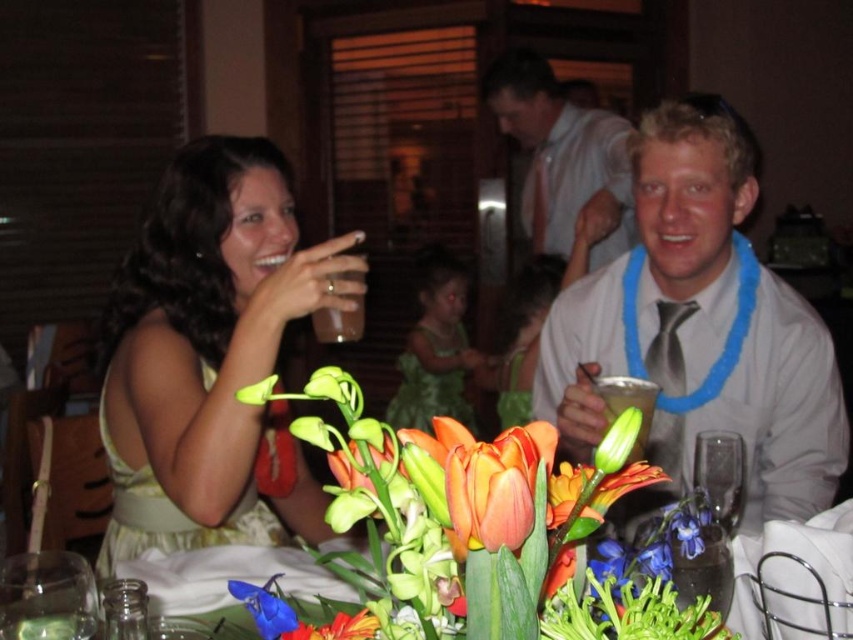
Question: Does white satin shirt at upper center appear over translucent plastic cup at upper center?

Choices:
 (A) yes
 (B) no

Answer: (A)

Question: Among these points, which one is farthest from the camera?

Choices:
 (A) pyautogui.click(x=688, y=611)
 (B) pyautogui.click(x=669, y=193)
 (C) pyautogui.click(x=93, y=621)

Answer: (B)

Question: Among these objects, which one is farthest from the camera?

Choices:
 (A) matte yellow dress at left
 (B) clear glass at lower left

Answer: (A)

Question: Can you confirm if silver metallic shirt at center is positioned above vibrant orange tulips at center?

Choices:
 (A) yes
 (B) no

Answer: (A)

Question: Among these points, which one is nearest to the camera?

Choices:
 (A) (343, 444)
 (B) (606, 387)

Answer: (A)

Question: Can you confirm if translucent plastic cup at center is wider than clear glass at lower left?

Choices:
 (A) yes
 (B) no

Answer: (A)